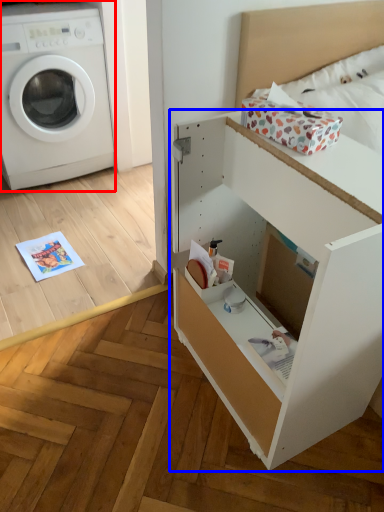
Question: Among these objects, which one is farthest to the camera, washing machine (highlighted by a red box) or file cabinet (highlighted by a blue box)?

Choices:
 (A) washing machine
 (B) file cabinet

Answer: (A)